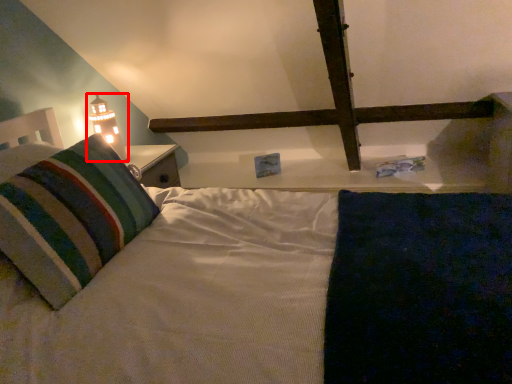
Question: From the image's perspective, considering the relative positions of table lamp (annotated by the red box) and pillow in the image provided, where is table lamp (annotated by the red box) located with respect to the staircase?

Choices:
 (A) above
 (B) below

Answer: (A)